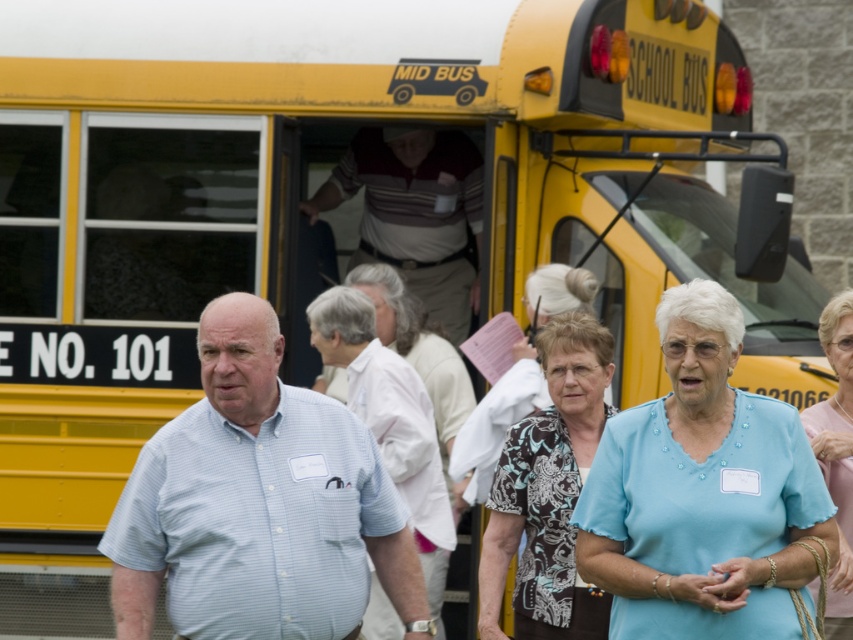
You are a photographer trying to capture a clear photo of both the light blue fabric at center and the light blue shirt at center. Since they are both light blue, you want to ensure you focus on the one that is closer to you. Which one should you focus on?

The light blue fabric at center is closer to the viewer than the light blue shirt at center, so you should focus on the light blue fabric at center.

You are a photographer trying to capture a group photo of the people near the yellow school bus labeled MID BUS and SCHOOL BUS at the top front. The people include those in the light blue striped shirt at center and the striped polo shirt at center. Based on their positions, which person should you focus on first to ensure they are in the frame?

The light blue striped shirt at center is located below the striped polo shirt at center. Since the photographer wants to ensure everyone is in the frame, they should focus on the striped polo shirt at center first as it is higher up and might be easier to frame initially.

You are a photographer taking a picture of the striped polo shirt at center and the light blue shirt at center. Which shirt should you focus on first if you want to capture both in the same frame without moving the camera?

The striped polo shirt at center has a lesser height compared to light blue shirt at center, so you should focus on the striped polo shirt at center first to ensure both are in frame without moving the camera.